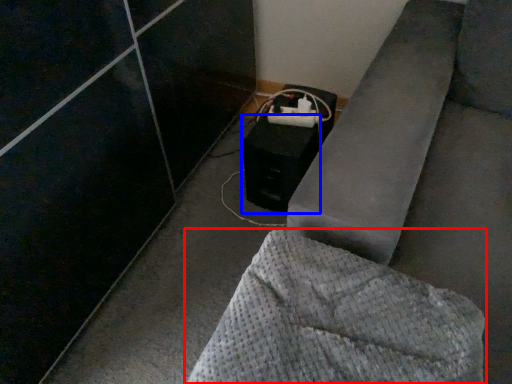
Question: Which of the following is the closest to the observer, furniture (highlighted by a red box) or speaker (highlighted by a blue box)?

Choices:
 (A) furniture
 (B) speaker

Answer: (A)